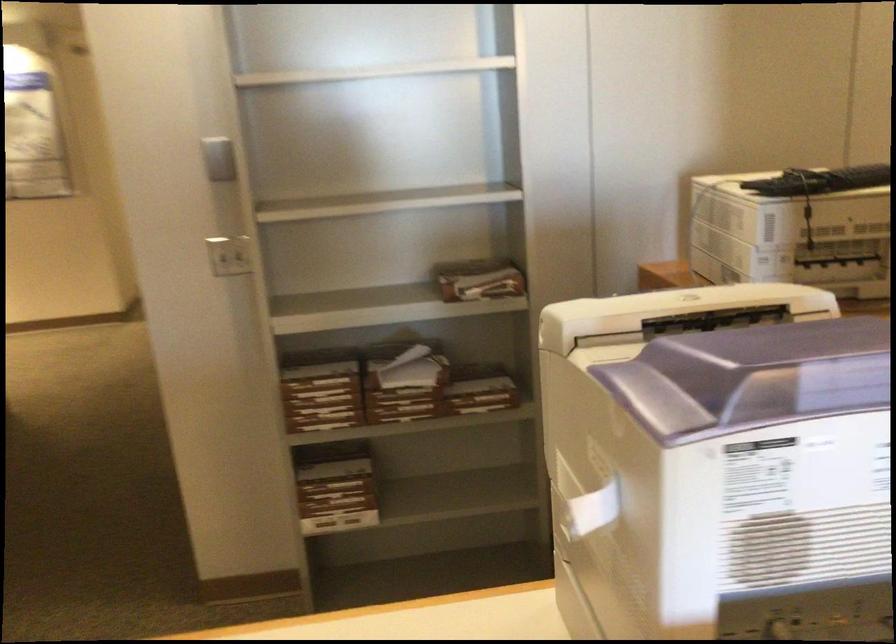
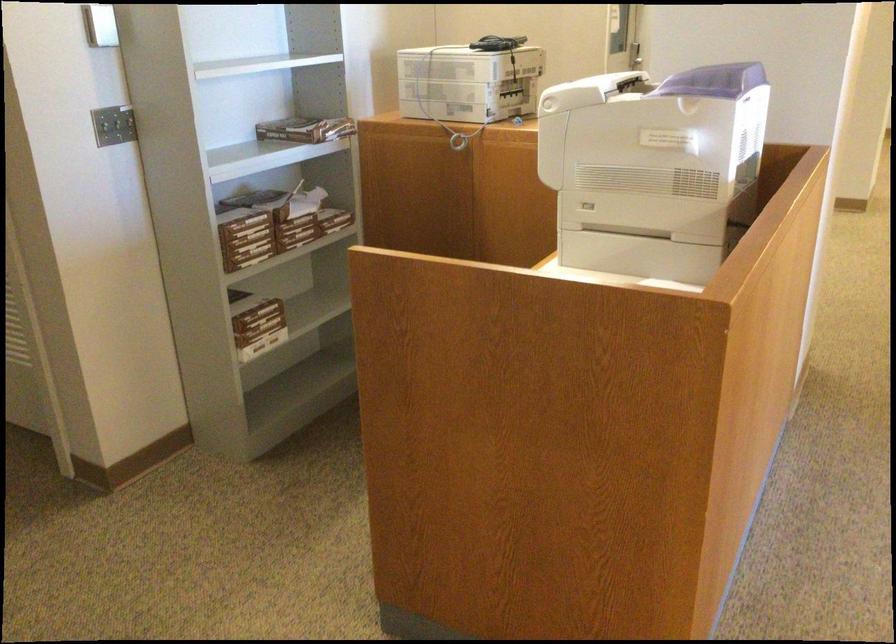
Where in the second image is the point corresponding to pixel 717 460 from the first image?

(714, 80)